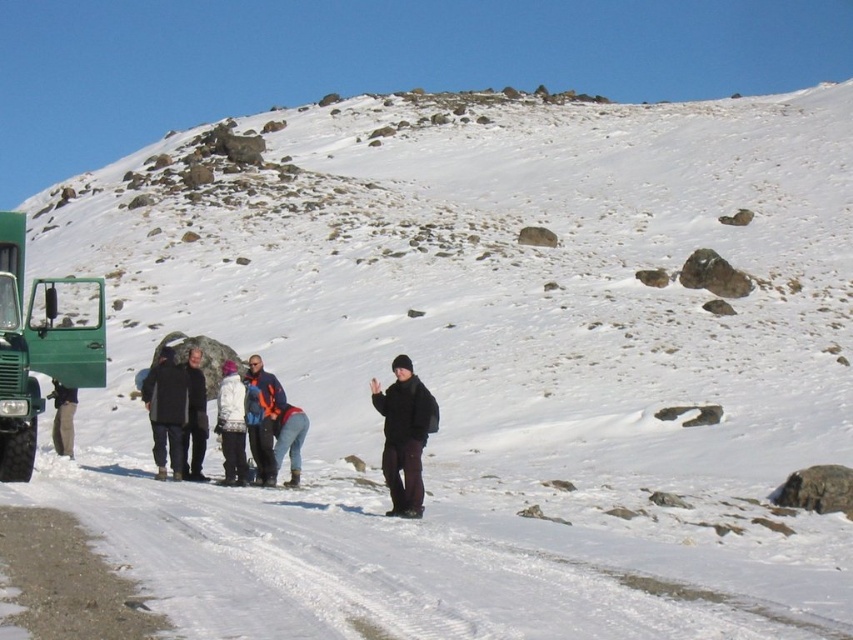
Question: Is green matte truck at left above dark gray fabric jacket at center?

Choices:
 (A) no
 (B) yes

Answer: (B)

Question: Is green matte truck at left wider than orange fleece jacket at center?

Choices:
 (A) no
 (B) yes

Answer: (B)

Question: Which of the following is the closest to the observer?

Choices:
 (A) dark gray pants at center
 (B) black matte jacket at center

Answer: (B)

Question: Which point is closer to the camera?

Choices:
 (A) (265, 417)
 (B) (183, 388)

Answer: (A)

Question: Which point is farther to the camera?

Choices:
 (A) (238, 396)
 (B) (165, 419)

Answer: (A)

Question: In this image, where is dark gray fabric jacket at center located relative to white fuzzy jacket at center?

Choices:
 (A) above
 (B) below

Answer: (B)